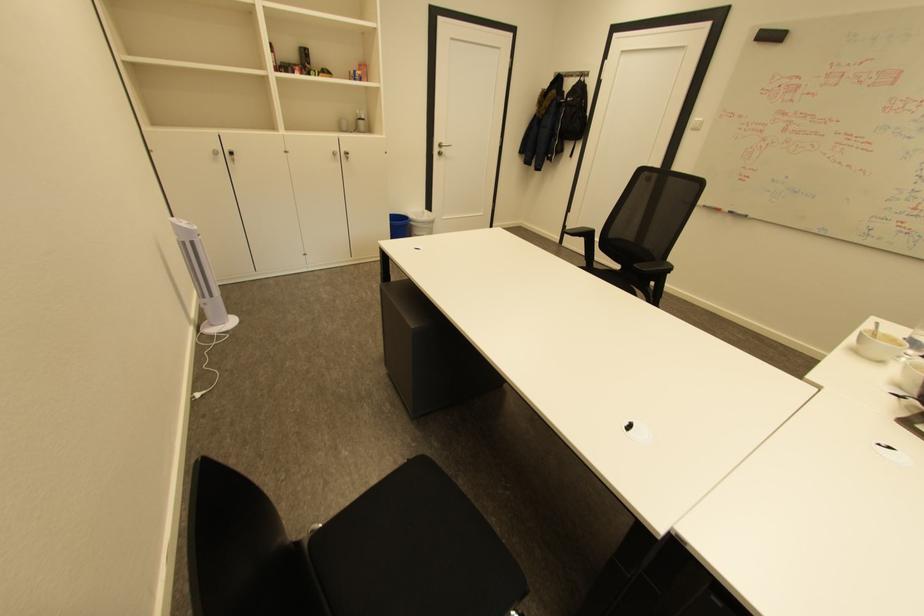
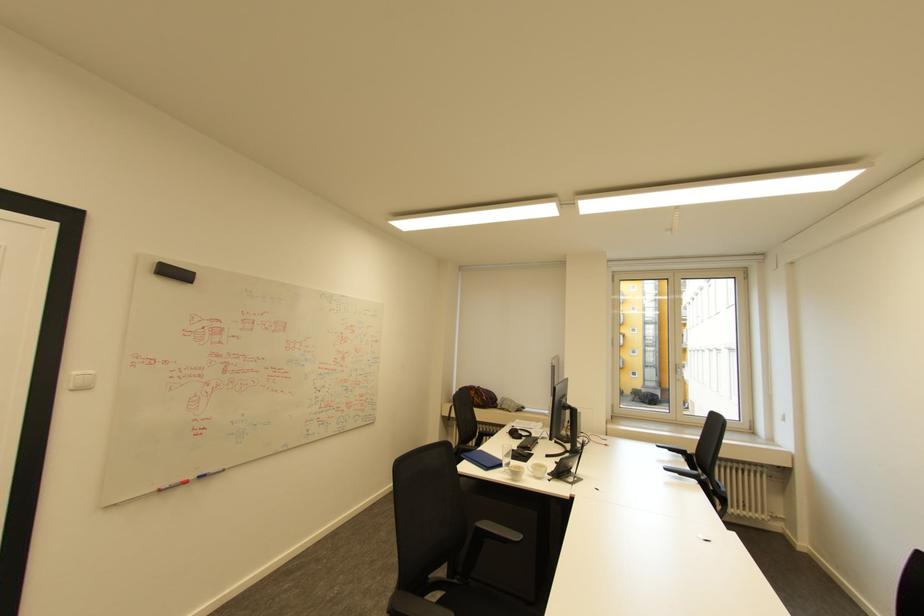
Locate, in the second image, the point that corresponds to pixel 737 212 in the first image.

(207, 477)